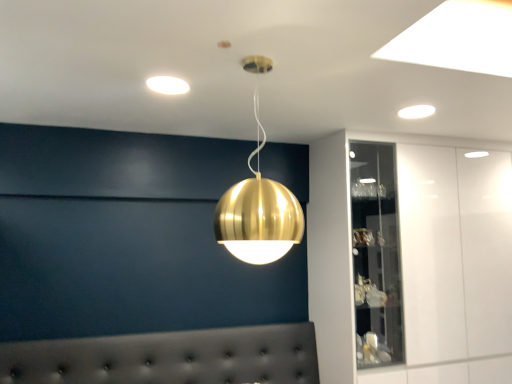
Question: Is point (481, 168) closer or farther from the camera than point (409, 109)?

Choices:
 (A) closer
 (B) farther

Answer: (B)

Question: Is white glossy cabinet at upper right in front of or behind white glossy light fixture at upper right, the second lamp when ordered from bottom to top, in the image?

Choices:
 (A) behind
 (B) front

Answer: (A)

Question: Estimate the real-world distances between objects in this image. Which object is closer to the gold metallic sphere at center, marked as the third lamp in a top-to-bottom arrangement?

Choices:
 (A) white glossy light fixture at upper right, acting as the first lamp starting from the right
 (B) white glossy cabinet at upper right
 (C) tufted leather headboard at lower center
 (D) matte white light fixture at upper center, placed as the first lamp when sorted from left to right

Answer: (D)

Question: Considering the real-world distances, which object is closest to the white glossy cabinet at upper right?

Choices:
 (A) white glossy light fixture at upper right, the first lamp viewed from the back
 (B) matte white light fixture at upper center, the second lamp viewed from the back
 (C) tufted leather headboard at lower center
 (D) gold metallic sphere at center, which is the first lamp from bottom to top

Answer: (C)